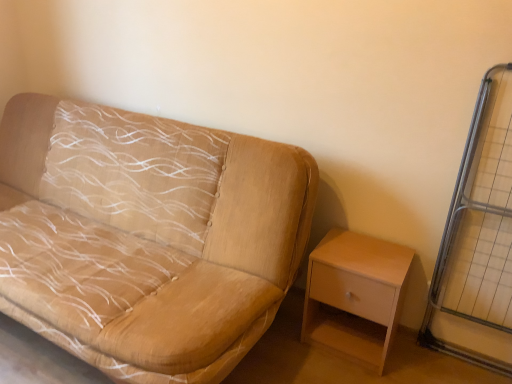
This screenshot has width=512, height=384. I want to click on vacant space positioned to the left of light wood/wooden nightstand at lower right, so click(x=281, y=354).